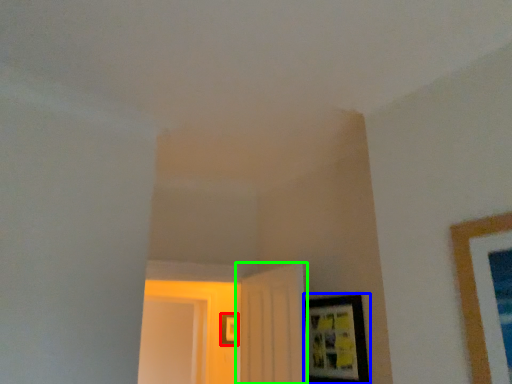
Question: Which object is the closest to the picture frame (highlighted by a red box)? Choose among these: picture frame (highlighted by a blue box) or door (highlighted by a green box).

Choices:
 (A) picture frame
 (B) door

Answer: (B)